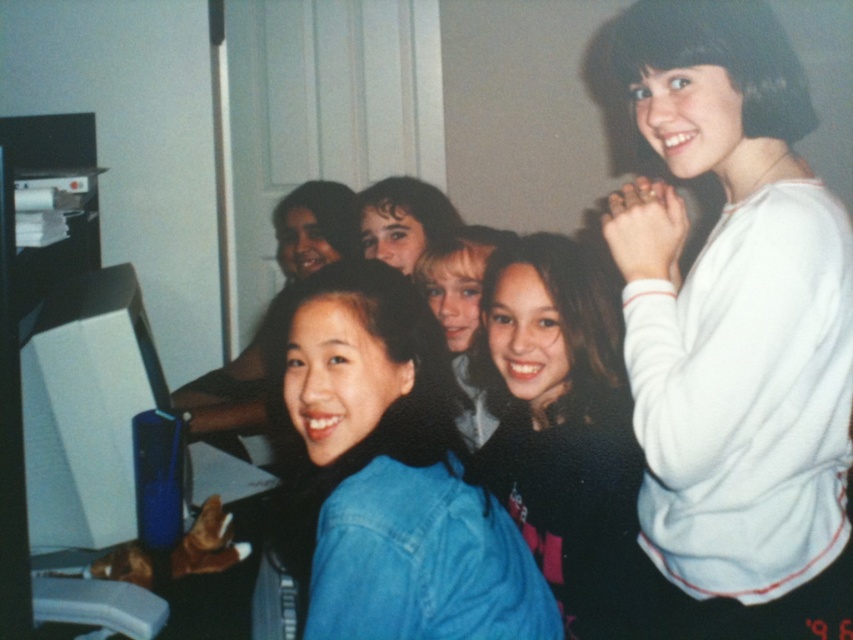
In the scene shown: You are a photographer trying to capture a group photo of the six individuals in the scene. You want to ensure that the white fleece sweater at upper right and the black matte shirt at center are both clearly visible in the photo. Given their current positions, is there enough space between them to allow both to be in focus simultaneously?

The white fleece sweater at upper right is 8.07 inches away from the black matte shirt at center. Since this distance is relatively small, it is likely that both can be in focus simultaneously in the group photo, provided the camera settings are adjusted appropriately for the depth of field.

You are trying to decide which clothing item to take from the group photo for a fashion show. The denim jacket at center and the black matte shirt at center are both options. Which one is smaller in size?

The denim jacket at center has a smaller size compared to the black matte shirt at center, so the denim jacket at center is the smaller one.

In the scene shown: You are standing in the room and want to pick up both items located at point (840, 560) and point (589, 417). Which point should you reach for first to grab the item that is closer to you?

Point (840, 560) is closer to the camera than point (589, 417), so you should reach for point (840, 560) first to grab the item that is closer to you.